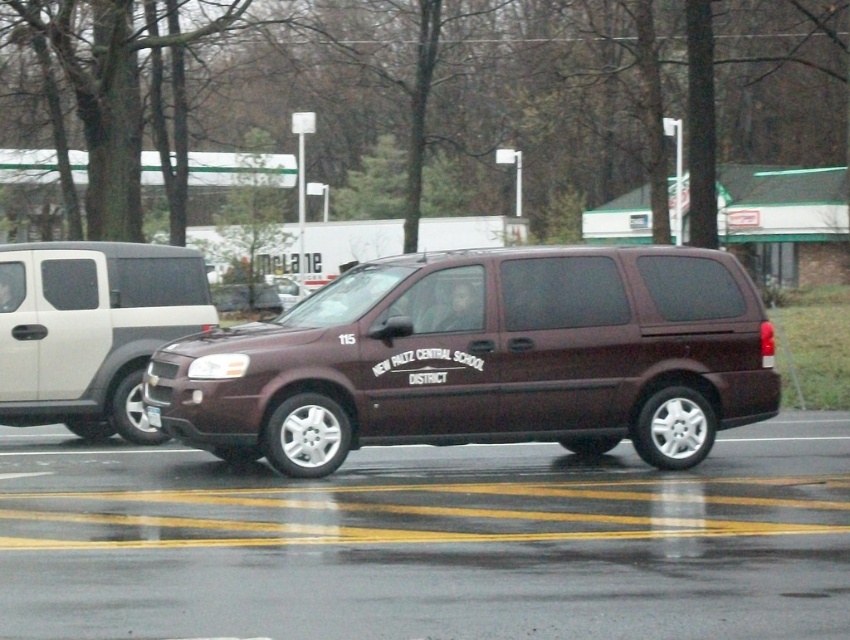
Is satin dark brown minivan at center above matte white suv at left?

No, satin dark brown minivan at center is not above matte white suv at left.

Can you confirm if satin dark brown minivan at center is positioned below matte white suv at left?

Indeed, satin dark brown minivan at center is positioned under matte white suv at left.

Who is more forward, (392,348) or (80,378)?

Point (392,348)

Where is `satin dark brown minivan at center`? satin dark brown minivan at center is located at coordinates (483, 358).

This screenshot has width=850, height=640. I want to click on matte black van at center, so click(x=326, y=248).

Is point (269, 248) farther from viewer compared to point (143, 420)?

Yes, it is behind point (143, 420).

You are a GUI agent. You are given a task and a screenshot of the screen. Output one action in this format:
    pyautogui.click(x=<x>, y=<y>)
    Task: Click on the matte black van at center
    The width and height of the screenshot is (850, 640).
    Given the screenshot: What is the action you would take?
    pyautogui.click(x=326, y=248)

Can you confirm if matte white suv at left is taller than matte black van at center?

Incorrect, matte white suv at left's height is not larger of matte black van at center's.

Who is positioned more to the left, matte white suv at left or matte black van at center?

From the viewer's perspective, matte white suv at left appears more on the left side.

Between point (201, 269) and point (319, 282), which one is positioned behind?

The point (319, 282) is more distant.

Find the location of a particular element. This screenshot has height=640, width=850. matte white suv at left is located at coordinates (91, 330).